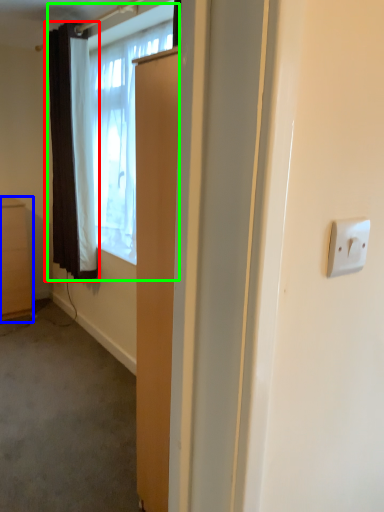
Question: Which is nearer to the curtain (highlighted by a red box)? cabinetry (highlighted by a blue box) or window (highlighted by a green box).

Choices:
 (A) cabinetry
 (B) window

Answer: (B)